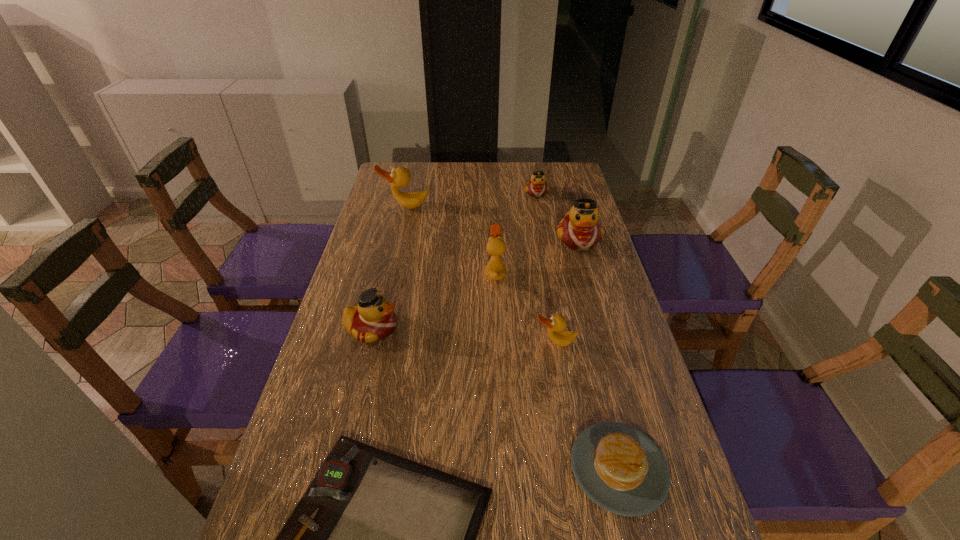
I want to click on vacant area located on the beak of the nearest tan duck, so click(x=560, y=369).

The image size is (960, 540). Find the location of `free spot located on the left of the second shortest object`. free spot located on the left of the second shortest object is located at coordinates (421, 468).

Identify the location of object that is at the far edge. This screenshot has width=960, height=540. (537, 187).

Locate an element on the screen. The height and width of the screenshot is (540, 960). pancake at the right edge is located at coordinates (618, 467).

At what (x,y) coordinates should I click in order to perform the action: click on object present at the far right corner. Please return your answer as a coordinate pair (x, y). Image resolution: width=960 pixels, height=540 pixels. Looking at the image, I should click on (537, 187).

You are a GUI agent. You are given a task and a screenshot of the screen. Output one action in this format:
    pyautogui.click(x=<x>, y=<y>)
    Task: Click on the vacant space at the far edge of the desktop
    
    Given the screenshot: What is the action you would take?
    pyautogui.click(x=517, y=181)

Identify the location of vacant space at the left edge of the desktop. (380, 214).

Find the location of a particular element. Image resolution: width=960 pixels, height=540 pixels. free location at the right edge is located at coordinates (605, 281).

Where is `free location at the far right corner of the desktop`? This screenshot has width=960, height=540. free location at the far right corner of the desktop is located at coordinates (554, 168).

Locate an element on the screen. Image resolution: width=960 pixels, height=540 pixels. blank region between the third farthest object and the smallest tan duck is located at coordinates (567, 291).